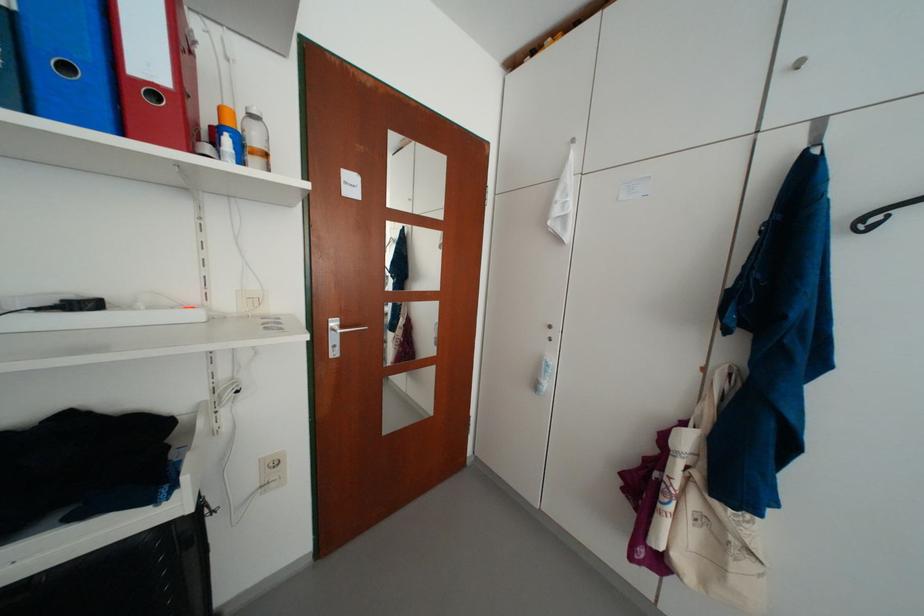
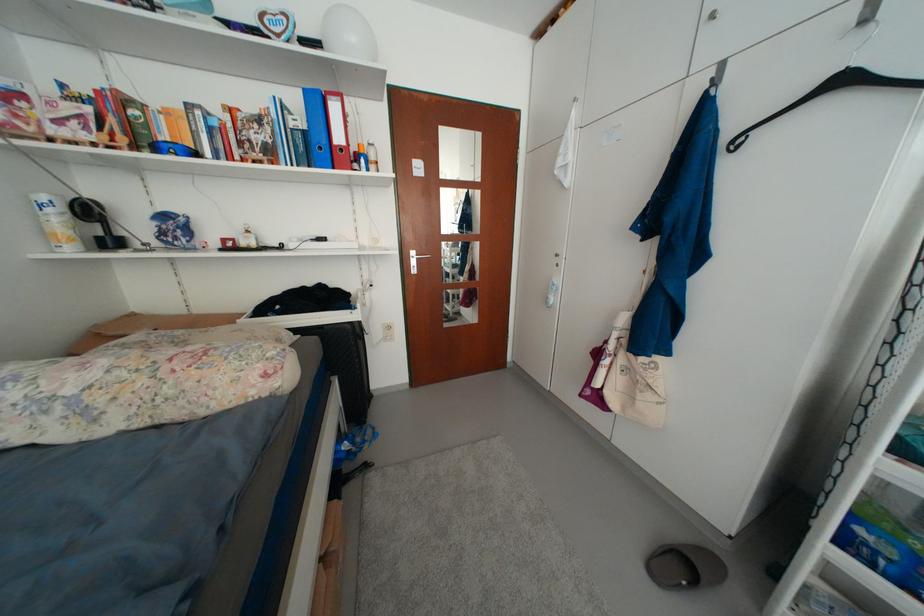
Question: The camera is either moving clockwise (left) or counter-clockwise (right) around the object. The first image is from the beginning of the video and the second image is from the end. Is the camera moving left or right when shooting the video?

Choices:
 (A) Left
 (B) Right

Answer: (B)